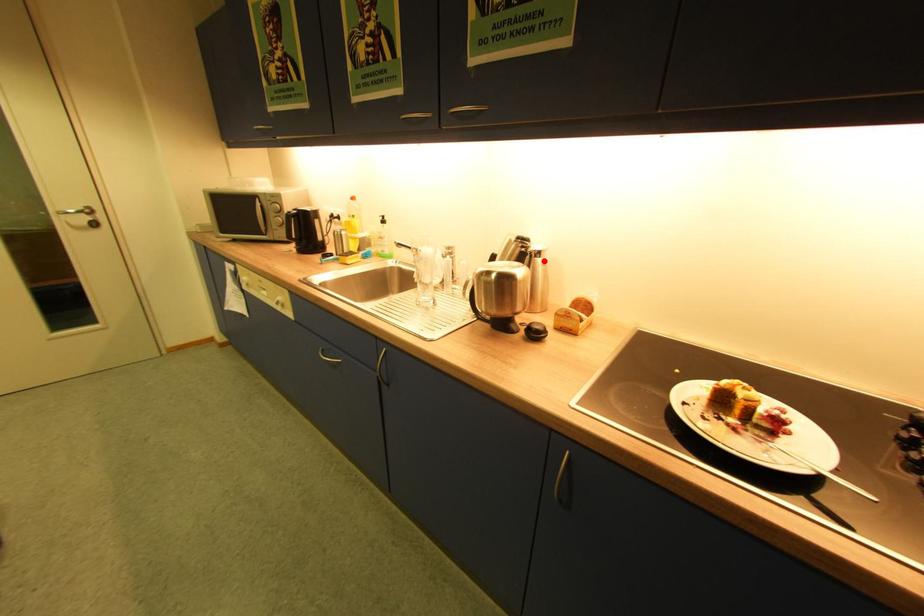
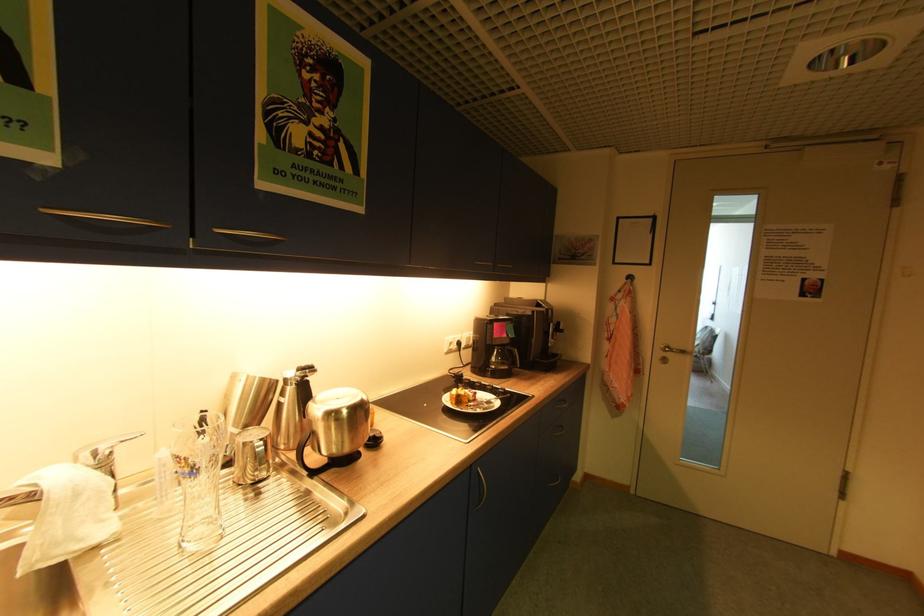
Locate, in the second image, the point that corresponds to the highlighted location in the first image.

(308, 386)